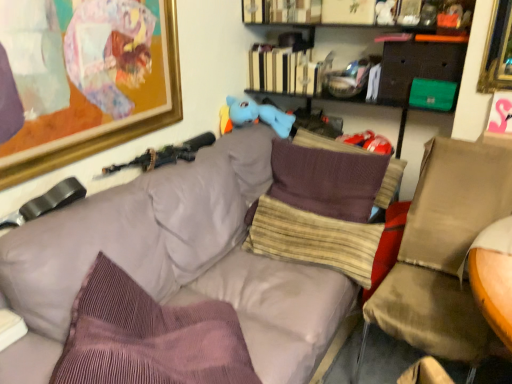
Question: Is gold-framed artwork at upper left to the right of striped fabric pillow at center, the 2th pillow when ordered from back to front, from the viewer's perspective?

Choices:
 (A) yes
 (B) no

Answer: (B)

Question: Does gold-framed artwork at upper left have a greater height compared to striped fabric pillow at center, the 2th pillow when ordered from back to front?

Choices:
 (A) yes
 (B) no

Answer: (A)

Question: Is gold-framed artwork at upper left oriented away from striped fabric pillow at center, which ranks as the second pillow in front-to-back order?

Choices:
 (A) no
 (B) yes

Answer: (A)

Question: Can you confirm if gold-framed artwork at upper left is thinner than striped fabric pillow at center, which ranks as the second pillow in front-to-back order?

Choices:
 (A) no
 (B) yes

Answer: (B)

Question: Considering the relative sizes of gold-framed artwork at upper left and striped fabric pillow at center, which ranks as the second pillow in front-to-back order, in the image provided, is gold-framed artwork at upper left shorter than striped fabric pillow at center, which ranks as the second pillow in front-to-back order,?

Choices:
 (A) no
 (B) yes

Answer: (A)

Question: From a real-world perspective, is striped fabric pillow at center, which ranks as the second pillow in front-to-back order, positioned above or below matte gray couch at center?

Choices:
 (A) below
 (B) above

Answer: (B)

Question: Is striped fabric pillow at center, which ranks as the second pillow in front-to-back order, bigger or smaller than matte gray couch at center?

Choices:
 (A) small
 (B) big

Answer: (A)

Question: Is striped fabric pillow at center, the 2th pillow when ordered from back to front, situated inside matte gray couch at center or outside?

Choices:
 (A) inside
 (B) outside

Answer: (A)

Question: Relative to matte gray couch at center, is striped fabric pillow at center, which ranks as the second pillow in front-to-back order, in front or behind?

Choices:
 (A) behind
 (B) front

Answer: (A)

Question: Considering the positions of matte gray couch at center and hardcover book at upper center in the image, is matte gray couch at center wider or thinner than hardcover book at upper center?

Choices:
 (A) thin
 (B) wide

Answer: (B)

Question: Considering the positions of matte gray couch at center and hardcover book at upper center in the image, is matte gray couch at center taller or shorter than hardcover book at upper center?

Choices:
 (A) short
 (B) tall

Answer: (B)

Question: Is matte gray couch at center to the left or to the right of hardcover book at upper center in the image?

Choices:
 (A) left
 (B) right

Answer: (A)

Question: Choose the correct answer: Is matte gray couch at center inside hardcover book at upper center or outside it?

Choices:
 (A) inside
 (B) outside

Answer: (B)

Question: In terms of height, does brown fabric swivel chair at right look taller or shorter compared to purple corduroy pillow at center, which is counted as the third pillow, starting from the back?

Choices:
 (A) short
 (B) tall

Answer: (B)

Question: Is brown fabric swivel chair at right inside the boundaries of purple corduroy pillow at center, which is counted as the third pillow, starting from the back, or outside?

Choices:
 (A) inside
 (B) outside

Answer: (B)